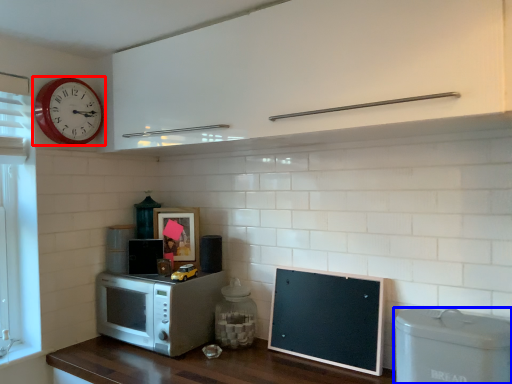
Question: Among these objects, which one is nearest to the camera, wall clock (highlighted by a red box) or appliance (highlighted by a blue box)?

Choices:
 (A) wall clock
 (B) appliance

Answer: (B)